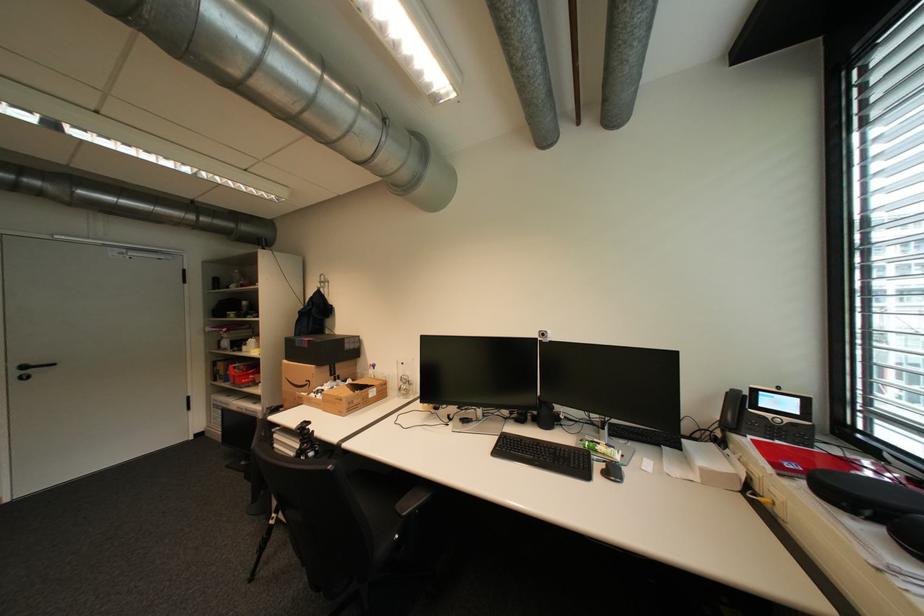
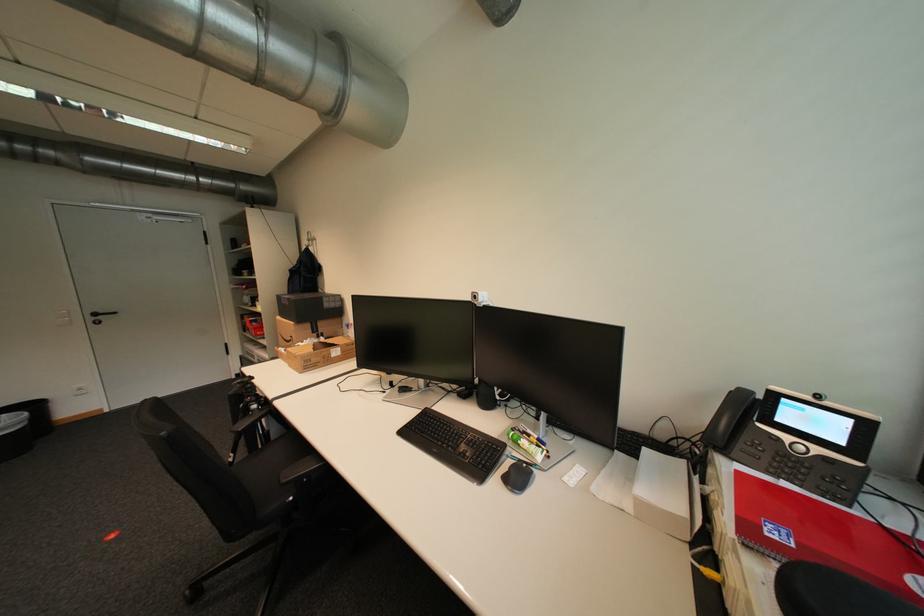
In the second image, find the point that corresponds to [606,467] in the first image.

(514, 467)